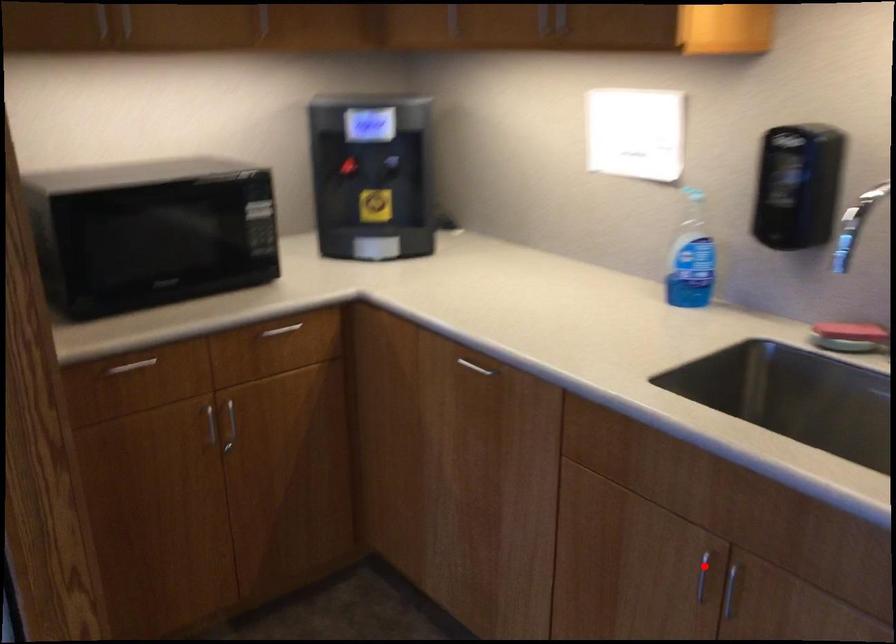
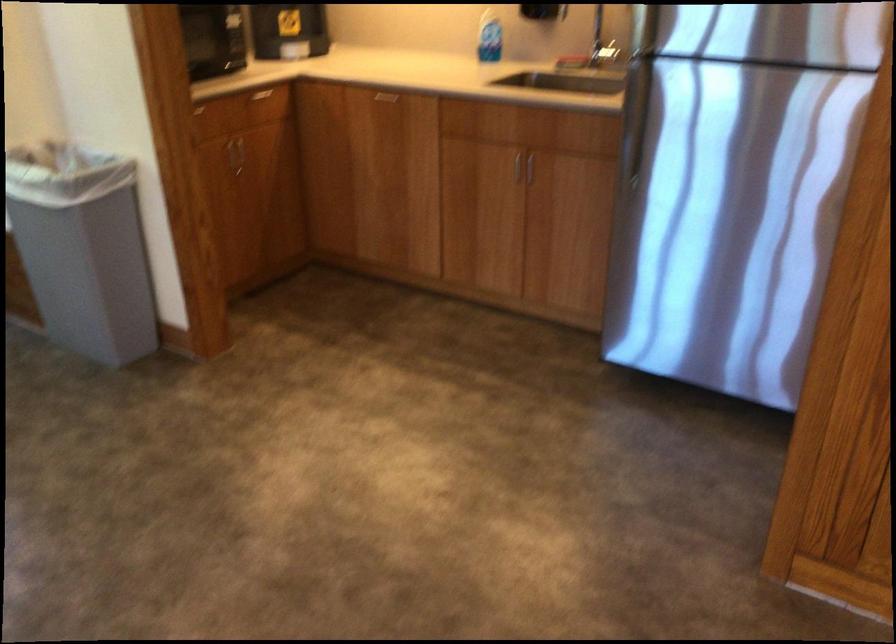
In the second image, find the point that corresponds to the highlighted location in the first image.

(515, 165)